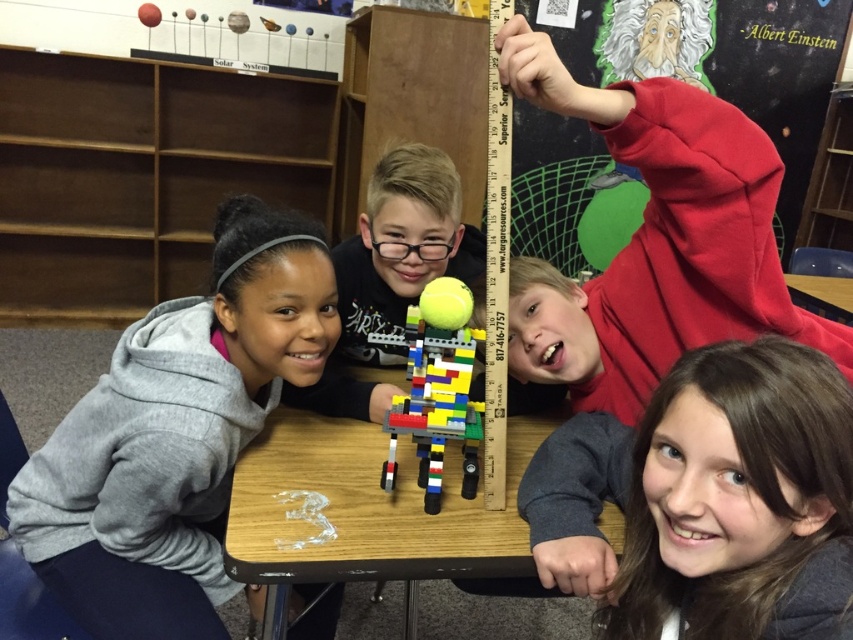
You are a teacher in the classroom and want to ensure the gray fleece hoodie at left is within a safe distance from the multicolored plastic lego robot at center to prevent it from being knocked over. The recommended safe distance is 12 inches. Is the current distance sufficient?

The distance between the gray fleece hoodie at left and the multicolored plastic lego robot at center is 11.30 inches, which is less than the recommended 12 inches. Therefore, the hoodie is too close and could potentially knock over the LEGO robot.

You are a photographer standing in the classroom scene. You need to take a picture of the gray fleece hoodie at left without moving it. Can you position yourself 3 feet away from the hoodie to capture it clearly?

The gray fleece hoodie at left and camera are 3.42 feet apart, so yes, you can position yourself 3 feet away from the hoodie to capture it clearly since the distance between them is sufficient.

You are a teacher observing the classroom scene. You notice the wooden table at center and the gray fleece hoodie at left. Can you determine which object is closer to the front of the classroom?

The gray fleece hoodie at left is closer to the front of the classroom because the wooden table at center is behind it.